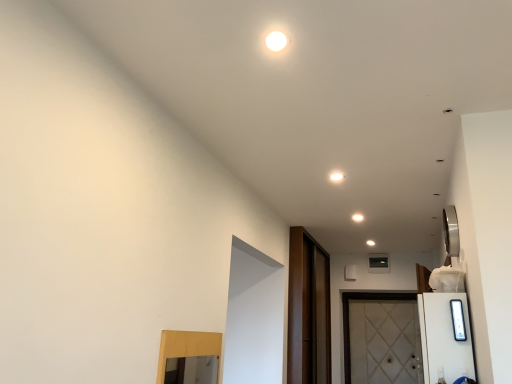
The width and height of the screenshot is (512, 384). What do you see at coordinates (308, 311) in the screenshot?
I see `dark brown wood screen door at center` at bounding box center [308, 311].

Locate an element on the screen. white textured door at lower right is located at coordinates (382, 339).

You are a GUI agent. You are given a task and a screenshot of the screen. Output one action in this format:
    pyautogui.click(x=<x>, y=<y>)
    Task: Click on the white glossy light at upper center
    This screenshot has height=384, width=512.
    Given the screenshot: What is the action you would take?
    pyautogui.click(x=336, y=176)

Between dark brown wood screen door at center and white glossy light at upper center, which one has smaller size?

white glossy light at upper center is smaller.

Is dark brown wood screen door at center aimed at white glossy light at upper center?

No, dark brown wood screen door at center is not oriented towards white glossy light at upper center.

Is there a large distance between dark brown wood screen door at center and white glossy light at upper center?

Yes, dark brown wood screen door at center and white glossy light at upper center are quite far apart.

From the picture: Is white glossy light at upper center inside white textured door at lower right?

No, white glossy light at upper center is not surrounded by white textured door at lower right.

Is white textured door at lower right aimed at white glossy light at upper center?

Yes, white textured door at lower right faces towards white glossy light at upper center.

From a real-world perspective, between white textured door at lower right and white glossy light at upper center, who is vertically lower?

white textured door at lower right is physically lower.

Based on the photo, between white textured door at lower right and white glossy light at upper center, which one has larger size?

white textured door at lower right.

Looking at this image, does dark brown wood screen door at center have a greater height compared to white textured door at lower right?

Correct, dark brown wood screen door at center is much taller as white textured door at lower right.

In order to click on door on the right of dark brown wood screen door at center in this screenshot , I will do `click(382, 339)`.

From the picture: Is dark brown wood screen door at center wider than white textured door at lower right?

No, dark brown wood screen door at center is not wider than white textured door at lower right.

Does dark brown wood screen door at center come behind white textured door at lower right?

No.

From a real-world perspective, is white glossy light at upper center physically located above or below white textured door at lower right?

Clearly, from a real-world perspective, white glossy light at upper center is above white textured door at lower right.

Considering the relative sizes of white glossy light at upper center and white textured door at lower right in the image provided, is white glossy light at upper center shorter than white textured door at lower right?

Correct, white glossy light at upper center is not as tall as white textured door at lower right.

Considering the positions of point (342, 177) and point (346, 367), is point (342, 177) closer or farther from the camera than point (346, 367)?

Point (342, 177) is closer to the camera than point (346, 367).

At what (x,y) coordinates should I click in order to perform the action: click on door on the right side of white glossy light at upper center. Please return your answer as a coordinate pair (x, y). Looking at the image, I should click on (382, 339).

Based on the photo, from a real-world perspective, which is physically below, white textured door at lower right or dark brown wood screen door at center?

In real-world perspective, white textured door at lower right is lower.

From the picture: Is the depth of white textured door at lower right less than that of dark brown wood screen door at center?

That is False.

From the image's perspective, is white textured door at lower right below dark brown wood screen door at center?

Yes, from the image's perspective, white textured door at lower right is beneath dark brown wood screen door at center.

Is white textured door at lower right shorter than dark brown wood screen door at center?

Indeed, white textured door at lower right has a lesser height compared to dark brown wood screen door at center.

Is white glossy light at upper center bigger or smaller than dark brown wood screen door at center?

Considering their sizes, white glossy light at upper center takes up less space than dark brown wood screen door at center.

Is point (344, 176) farther from camera compared to point (295, 323)?

No.

Find the location of a particular element. This screenshot has width=512, height=384. screen door beneath the white glossy light at upper center (from a real-world perspective) is located at coordinates 308,311.

The width and height of the screenshot is (512, 384). Identify the location of screen door that is under the white glossy light at upper center (from a real-world perspective). (308, 311).

Locate an element on the screen. The width and height of the screenshot is (512, 384). light on the left of white textured door at lower right is located at coordinates (336, 176).

Based on their spatial positions, is dark brown wood screen door at center or white textured door at lower right further from white glossy light at upper center?

The object further to white glossy light at upper center is white textured door at lower right.

Looking at the image, which one is located closer to white textured door at lower right, white glossy light at upper center or dark brown wood screen door at center?

dark brown wood screen door at center is closer to white textured door at lower right.

Which object lies further to the anchor point dark brown wood screen door at center, white glossy light at upper center or white textured door at lower right?

white glossy light at upper center lies further to dark brown wood screen door at center than the other object.

Estimate the real-world distances between objects in this image. Which object is closer to white textured door at lower right, dark brown wood screen door at center or white glossy light at upper center?

Based on the image, dark brown wood screen door at center appears to be nearer to white textured door at lower right.

In the scene shown: From the image, which object appears to be farther from white glossy light at upper center, white textured door at lower right or dark brown wood screen door at center?

white textured door at lower right is positioned further to the anchor white glossy light at upper center.

Estimate the real-world distances between objects in this image. Which object is closer to dark brown wood screen door at center, white textured door at lower right or white glossy light at upper center?

white textured door at lower right.

The image size is (512, 384). Find the location of `screen door between white glossy light at upper center and white textured door at lower right in the up-down direction`. screen door between white glossy light at upper center and white textured door at lower right in the up-down direction is located at coordinates (308, 311).